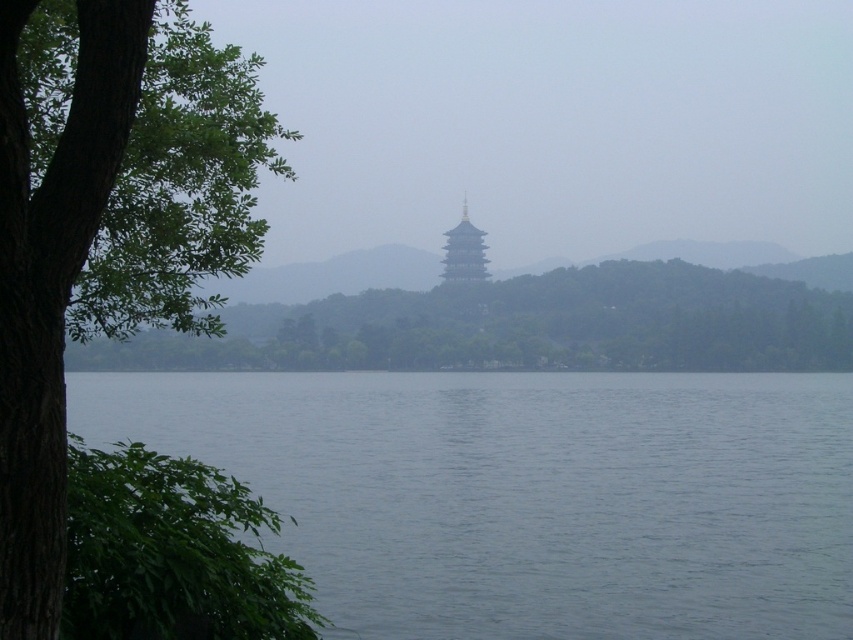
Consider the image. Does green leafy tree at left appear under green leafy tree at center?

Actually, green leafy tree at left is above green leafy tree at center.

Does green leafy tree at left have a smaller size compared to green leafy tree at center?

Actually, green leafy tree at left might be larger than green leafy tree at center.

Find the location of `green leafy tree at left`. green leafy tree at left is located at coordinates (105, 228).

I want to click on green leafy tree at left, so click(x=105, y=228).

Who is taller, gray water at center or green leafy tree at center?

With more height is green leafy tree at center.

Consider the image. Can you confirm if gray water at center is positioned to the left of green leafy tree at center?

Correct, you'll find gray water at center to the left of green leafy tree at center.

Is point (634, 401) behind point (766, 317)?

No, it is not.

Image resolution: width=853 pixels, height=640 pixels. Find the location of `gray water at center`. gray water at center is located at coordinates (529, 493).

Which of these two, gray water at center or green leafy tree at left, stands shorter?

With less height is gray water at center.

The image size is (853, 640). What do you see at coordinates (529, 493) in the screenshot?
I see `gray water at center` at bounding box center [529, 493].

Find the location of `gray water at center`. gray water at center is located at coordinates (529, 493).